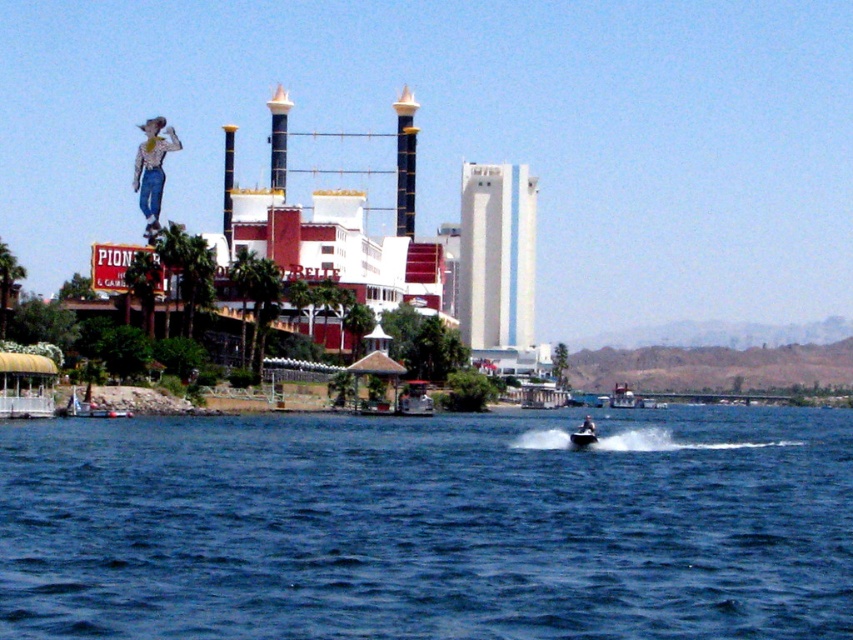
You are a photographer trying to capture the Pioneer Belle building and its surroundings. You notice the blue water at center and the dark blue fabric boat at lower right in your shot. Which object will occupy more space in your photo?

The blue water at center will occupy more space in the photo because it has a larger size compared to the dark blue fabric boat at lower right.

You are a tour guide explaining the Pioneer Belle building to a group. You point out the denim jeans cowboy at upper left and the metallic silver jet ski at lower center. How far apart are these two landmarks?

The denim jeans cowboy at upper left and the metallic silver jet ski at lower center are 388.44 feet apart.